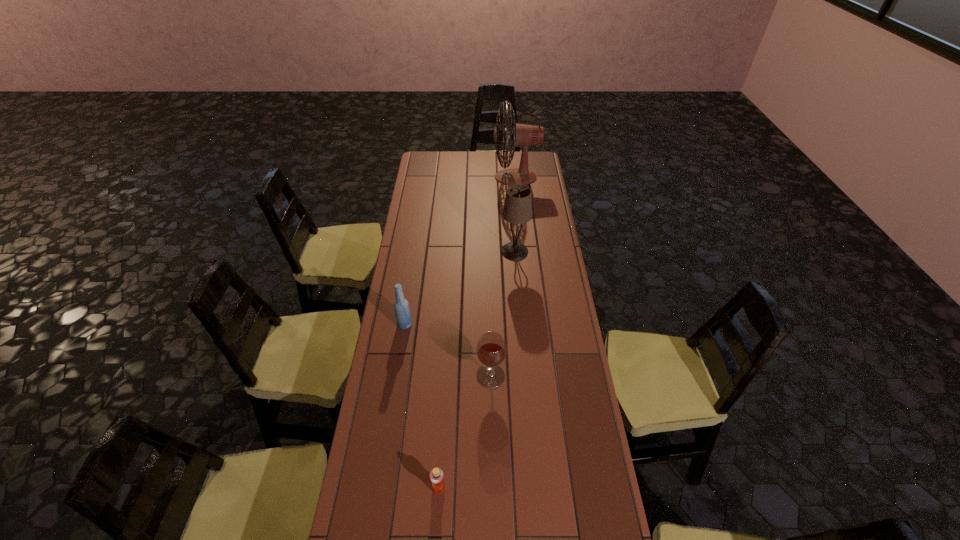
The height and width of the screenshot is (540, 960). Identify the location of fan located at the right edge. (521, 135).

Where is `lampshade situated at the right edge`? This screenshot has width=960, height=540. lampshade situated at the right edge is located at coordinates (517, 209).

Where is `object that is at the far right corner`? object that is at the far right corner is located at coordinates (521, 135).

Identify the location of free space at the far edge. (460, 173).

This screenshot has width=960, height=540. In the image, there is a desktop. Identify the location of free space at the left edge. (399, 465).

In the image, there is a desktop. Where is `blank space at the right edge`? The width and height of the screenshot is (960, 540). blank space at the right edge is located at coordinates (540, 295).

You are a GUI agent. You are given a task and a screenshot of the screen. Output one action in this format:
    pyautogui.click(x=<x>, y=<y>)
    Task: Click on the unoccupied position between the fan and the orange juice
    
    Given the screenshot: What is the action you would take?
    pyautogui.click(x=477, y=333)

Where is `blank region between the wineglass and the leftmost object`? The height and width of the screenshot is (540, 960). blank region between the wineglass and the leftmost object is located at coordinates (447, 350).

At what (x,y) coordinates should I click in order to perform the action: click on free space between the second tallest object and the nearest object. Please return your answer as a coordinate pair (x, y). Looking at the image, I should click on (477, 370).

Identify the location of free area in between the farthest object and the orange juice. The width and height of the screenshot is (960, 540). (477, 333).